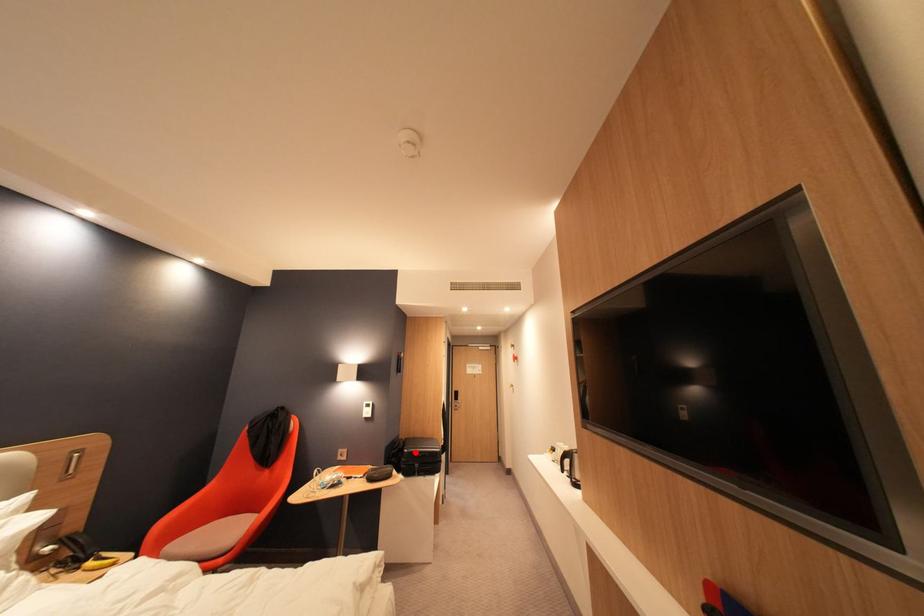
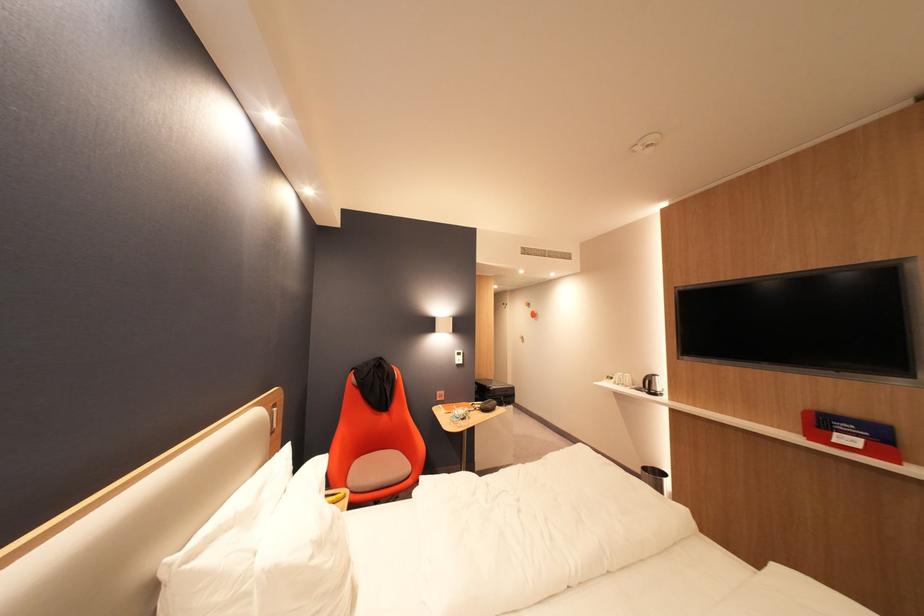
Find the pixel in the second image that matches the highlighted location in the first image.

(502, 390)